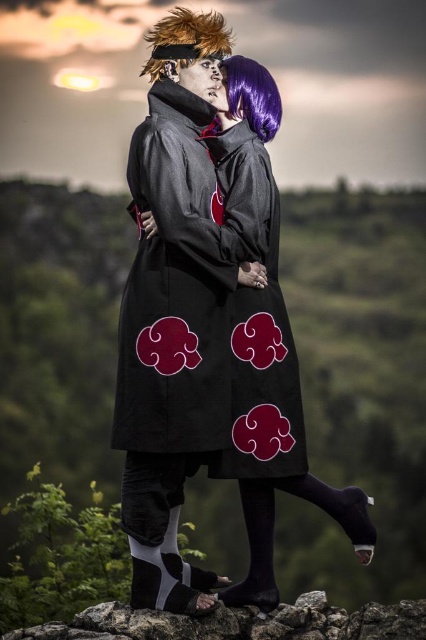
Between point (152, 637) and point (250, 122), which one is positioned in front?

Point (152, 637) is more forward.

Does smooth rock at lower center appear over purple silky wig at upper center?

No, smooth rock at lower center is not above purple silky wig at upper center.

Between point (321, 612) and point (252, 100), which one is positioned behind?

The point (252, 100) is more distant.

You are a GUI agent. You are given a task and a screenshot of the screen. Output one action in this format:
    pyautogui.click(x=<x>, y=<y>)
    Task: Click on the smooth rock at lower center
    Image resolution: width=426 pixels, height=640 pixels.
    Given the screenshot: What is the action you would take?
    pyautogui.click(x=241, y=621)

Can you confirm if black fabric cloak at center is shorter than purple silky wig at upper center?

No, black fabric cloak at center is not shorter than purple silky wig at upper center.

Does black fabric cloak at center have a greater width compared to purple silky wig at upper center?

Indeed, black fabric cloak at center has a greater width compared to purple silky wig at upper center.

What do you see at coordinates (209, 316) in the screenshot? This screenshot has width=426, height=640. I see `black fabric cloak at center` at bounding box center [209, 316].

Find the location of a particular element. black fabric cloak at center is located at coordinates (209, 316).

Is smooth rock at lower center positioned at the back of spiky orange hair at upper left?

No, it is in front of spiky orange hair at upper left.

Does smooth rock at lower center appear on the right side of spiky orange hair at upper left?

Indeed, smooth rock at lower center is positioned on the right side of spiky orange hair at upper left.

Who is more distant from viewer, (238, 614) or (180, 20)?

Point (180, 20)

Find the location of a particular element. The width and height of the screenshot is (426, 640). smooth rock at lower center is located at coordinates (241, 621).